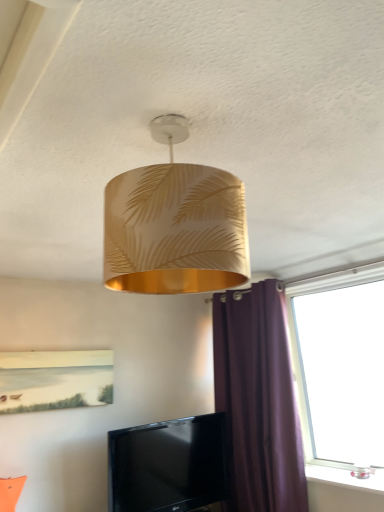
This screenshot has width=384, height=512. What are the coordinates of `purple fabric curtain at right` in the screenshot? It's located at (258, 401).

Identify the location of transparent glass window at right. The width and height of the screenshot is (384, 512). (340, 370).

Where is `gold leaf-patterned lampshade at upper center`? gold leaf-patterned lampshade at upper center is located at coordinates (174, 224).

In order to face black glossy tv at lower center, should I rotate leftwards or rightwards?

To align with it, rotate left about 2.621°.

Locate an element on the screen. Image resolution: width=384 pixels, height=512 pixels. purple fabric curtain at right is located at coordinates (258, 401).

Would you say transparent glass window at right is a long distance from gold leaf-patterned lampshade at upper center?

Yes, transparent glass window at right and gold leaf-patterned lampshade at upper center are quite far apart.

Is transparent glass window at right not within gold leaf-patterned lampshade at upper center?

Absolutely, transparent glass window at right is external to gold leaf-patterned lampshade at upper center.

From the image's perspective, which is above, transparent glass window at right or gold leaf-patterned lampshade at upper center?

gold leaf-patterned lampshade at upper center is shown above in the image.

Does point (307, 315) come closer to viewer compared to point (168, 195)?

No, (307, 315) is behind (168, 195).

Are purple fabric curtain at right and gold leaf-patterned lampshade at upper center far apart?

Yes, purple fabric curtain at right and gold leaf-patterned lampshade at upper center are quite far apart.

Considering the sizes of objects purple fabric curtain at right and gold leaf-patterned lampshade at upper center in the image provided, who is shorter, purple fabric curtain at right or gold leaf-patterned lampshade at upper center?

Standing shorter between the two is gold leaf-patterned lampshade at upper center.

How many degrees apart are the facing directions of purple fabric curtain at right and gold leaf-patterned lampshade at upper center?

There is a 96.9-degree angle between the facing directions of purple fabric curtain at right and gold leaf-patterned lampshade at upper center.

Is purple fabric curtain at right aimed at gold leaf-patterned lampshade at upper center?

No, purple fabric curtain at right is not turned towards gold leaf-patterned lampshade at upper center.

Who is smaller, black glossy tv at lower center or gold leaf-patterned lampshade at upper center?

black glossy tv at lower center.

In the scene shown: From the image's perspective, which one is positioned higher, black glossy tv at lower center or gold leaf-patterned lampshade at upper center?

gold leaf-patterned lampshade at upper center, from the image's perspective.

Between black glossy tv at lower center and gold leaf-patterned lampshade at upper center, which one appears on the left side from the viewer's perspective?

From the viewer's perspective, black glossy tv at lower center appears more on the left side.

Does black glossy tv at lower center touch gold leaf-patterned lampshade at upper center?

black glossy tv at lower center and gold leaf-patterned lampshade at upper center are clearly separated.

Is point (142, 249) positioned in front of point (342, 376)?

Yes, point (142, 249) is closer to viewer.

Considering the relative sizes of gold leaf-patterned lampshade at upper center and transparent glass window at right in the image provided, is gold leaf-patterned lampshade at upper center wider than transparent glass window at right?

Yes, gold leaf-patterned lampshade at upper center is wider than transparent glass window at right.

Which of these two, gold leaf-patterned lampshade at upper center or transparent glass window at right, is bigger?

Bigger between the two is transparent glass window at right.

From the image's perspective, between gold leaf-patterned lampshade at upper center and transparent glass window at right, which one is located above?

gold leaf-patterned lampshade at upper center.

Would you say gold leaf-patterned lampshade at upper center is a long distance from black glossy tv at lower center?

gold leaf-patterned lampshade at upper center is far away from black glossy tv at lower center.

From the image's perspective, is gold leaf-patterned lampshade at upper center located beneath black glossy tv at lower center?

No.

From a real-world perspective, does gold leaf-patterned lampshade at upper center sit lower than black glossy tv at lower center?

No.

Measure the distance from gold leaf-patterned lampshade at upper center to black glossy tv at lower center.

5.63 feet.

Is black glossy tv at lower center a part of purple fabric curtain at right?

No, black glossy tv at lower center is not inside purple fabric curtain at right.

Is point (298, 452) closer to viewer compared to point (125, 484)?

No, (298, 452) is further to viewer.

From a real-world perspective, is purple fabric curtain at right positioned above or below black glossy tv at lower center?

purple fabric curtain at right is above black glossy tv at lower center.

Is point (294, 462) positioned behind point (353, 417)?

No.

Does purple fabric curtain at right have a lesser width compared to transparent glass window at right?

In fact, purple fabric curtain at right might be wider than transparent glass window at right.

Are purple fabric curtain at right and transparent glass window at right located far from each other?

purple fabric curtain at right is actually quite close to transparent glass window at right.

Consider the image. Looking at the image, does purple fabric curtain at right seem bigger or smaller compared to transparent glass window at right?

Clearly, purple fabric curtain at right is larger in size than transparent glass window at right.

Where is `window beneath the gold leaf-patterned lampshade at upper center (from a real-world perspective)`? The width and height of the screenshot is (384, 512). window beneath the gold leaf-patterned lampshade at upper center (from a real-world perspective) is located at coordinates (340, 370).

Locate an element on the screen. The width and height of the screenshot is (384, 512). lamp above the purple fabric curtain at right (from a real-world perspective) is located at coordinates (174, 224).

Considering their positions, is black glossy tv at lower center positioned further to transparent glass window at right than gold leaf-patterned lampshade at upper center?

gold leaf-patterned lampshade at upper center is positioned further to the anchor transparent glass window at right.

Considering their positions, is purple fabric curtain at right positioned closer to black glossy tv at lower center than transparent glass window at right?

purple fabric curtain at right is closer to black glossy tv at lower center.

Estimate the real-world distances between objects in this image. Which object is closer to gold leaf-patterned lampshade at upper center, transparent glass window at right or black glossy tv at lower center?

Based on the image, transparent glass window at right appears to be nearer to gold leaf-patterned lampshade at upper center.

Which object lies nearer to the anchor point black glossy tv at lower center, gold leaf-patterned lampshade at upper center or transparent glass window at right?

transparent glass window at right lies closer to black glossy tv at lower center than the other object.

When comparing their distances from gold leaf-patterned lampshade at upper center, does black glossy tv at lower center or transparent glass window at right seem closer?

transparent glass window at right lies closer to gold leaf-patterned lampshade at upper center than the other object.

Considering their positions, is gold leaf-patterned lampshade at upper center positioned closer to transparent glass window at right than purple fabric curtain at right?

Based on the image, purple fabric curtain at right appears to be nearer to transparent glass window at right.

Considering their positions, is black glossy tv at lower center positioned closer to gold leaf-patterned lampshade at upper center than purple fabric curtain at right?

purple fabric curtain at right.

When comparing their distances from black glossy tv at lower center, does gold leaf-patterned lampshade at upper center or purple fabric curtain at right seem closer?

purple fabric curtain at right is positioned closer to the anchor black glossy tv at lower center.

Image resolution: width=384 pixels, height=512 pixels. Identify the location of window between gold leaf-patterned lampshade at upper center and purple fabric curtain at right in the front-back direction. (340, 370).

Find the location of a particular element. Image resolution: width=384 pixels, height=512 pixels. curtain between black glossy tv at lower center and transparent glass window at right is located at coordinates (258, 401).

At what (x,y) coordinates should I click in order to perform the action: click on window located between gold leaf-patterned lampshade at upper center and black glossy tv at lower center in the depth direction. Please return your answer as a coordinate pair (x, y). The height and width of the screenshot is (512, 384). Looking at the image, I should click on (340, 370).

Locate an element on the screen. curtain located between gold leaf-patterned lampshade at upper center and black glossy tv at lower center in the depth direction is located at coordinates (258, 401).